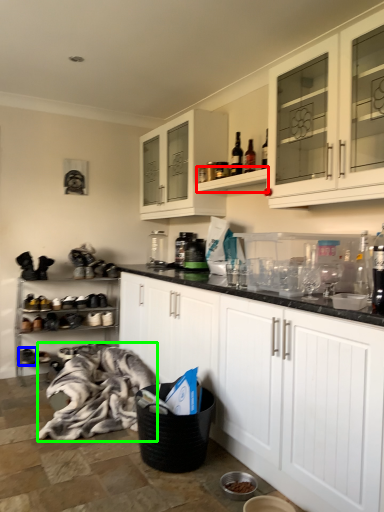
Question: Which object is the closest to the shelf (highlighted by a red box)? Choose among these: footwear (highlighted by a blue box) or blanket (highlighted by a green box).

Choices:
 (A) footwear
 (B) blanket

Answer: (B)